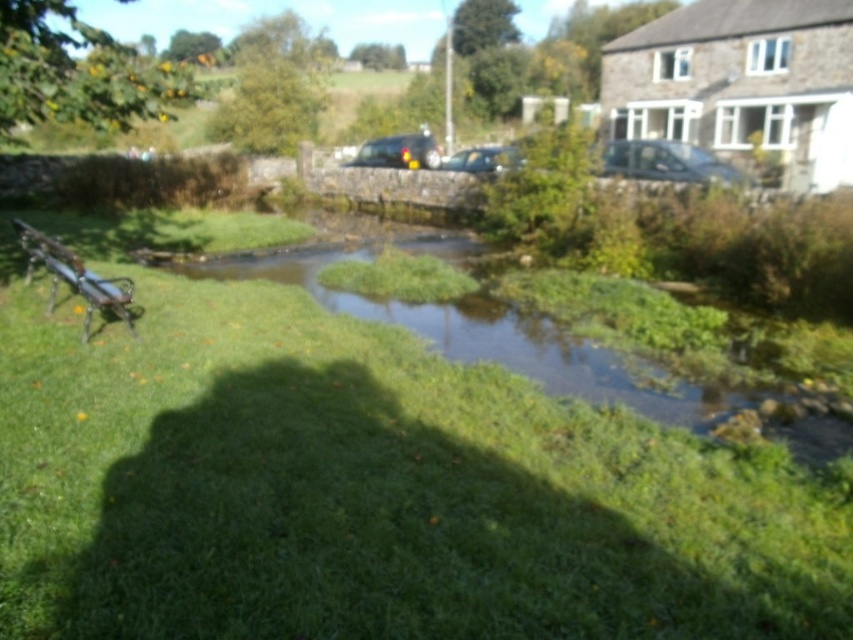
Question: Which of the following is the closest to the observer?

Choices:
 (A) green grass at center
 (B) metallic park bench at left

Answer: (A)

Question: Can you confirm if green grass at center is wider than metallic park bench at left?

Choices:
 (A) no
 (B) yes

Answer: (A)

Question: Which point is farther to the camera?

Choices:
 (A) green grass at center
 (B) metallic park bench at left

Answer: (B)

Question: Is green grass at center closer to the viewer compared to metallic park bench at left?

Choices:
 (A) no
 (B) yes

Answer: (B)

Question: Is green grass at center bigger than metallic park bench at left?

Choices:
 (A) no
 (B) yes

Answer: (A)